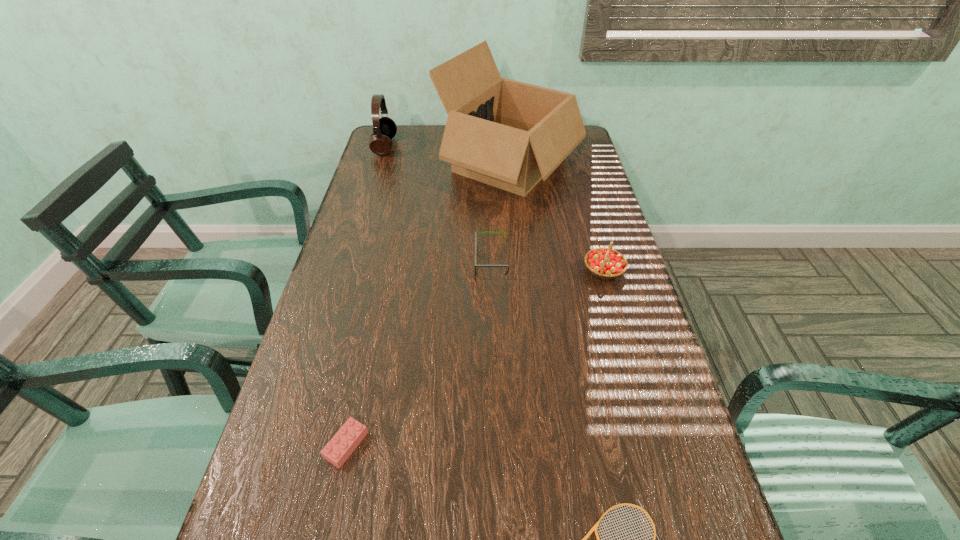
This screenshot has height=540, width=960. In order to click on the tallest object in this screenshot , I will do `click(508, 134)`.

The width and height of the screenshot is (960, 540). In order to click on the fifth shortest object in this screenshot , I will do `click(384, 128)`.

Find the location of `the leftmost object`. the leftmost object is located at coordinates (384, 128).

Locate an element on the screen. strawberry is located at coordinates (606, 263).

This screenshot has height=540, width=960. Find the location of `the third shortest object`. the third shortest object is located at coordinates (476, 265).

At what (x,y) coordinates should I click in order to perform the action: click on the second object from left to right. Please return your answer as a coordinate pair (x, y). Looking at the image, I should click on pyautogui.click(x=344, y=442).

Where is `Lego`? This screenshot has height=540, width=960. Lego is located at coordinates (344, 442).

The height and width of the screenshot is (540, 960). What are the coordinates of `blank space located on the left of the box` in the screenshot? It's located at (403, 163).

Locate an element on the screen. This screenshot has height=540, width=960. free space located on the ear pads of the headset is located at coordinates (428, 146).

Find the location of a particular element. The height and width of the screenshot is (540, 960). free spot located on the left of the strawberry is located at coordinates (500, 270).